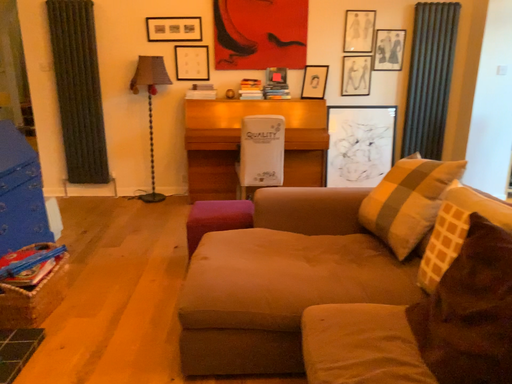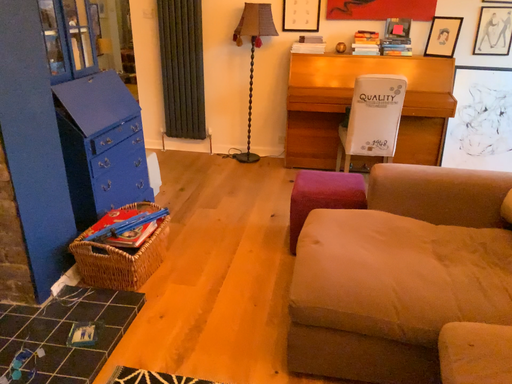
Question: How did the camera likely rotate when shooting the video?

Choices:
 (A) rotated left
 (B) rotated right

Answer: (A)